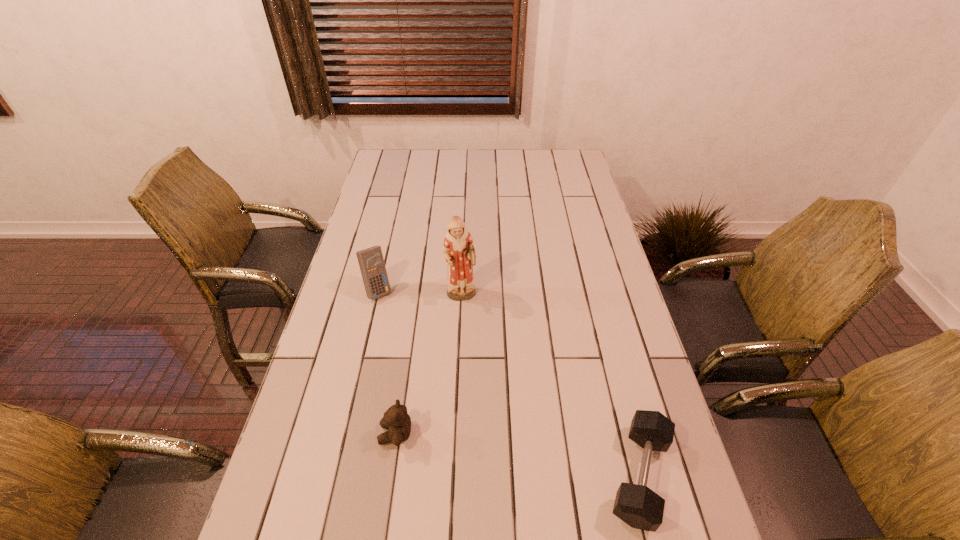
Where is `free space on the desktop that is between the second shortest object and the shortest object and is positioned on the front-facing side of the figurine`? The image size is (960, 540). free space on the desktop that is between the second shortest object and the shortest object and is positioned on the front-facing side of the figurine is located at coordinates (515, 455).

I want to click on vacant spot on the desktop that is between the teddy bear and the rightmost object and is positioned on the front-facing side of the calculator, so click(503, 453).